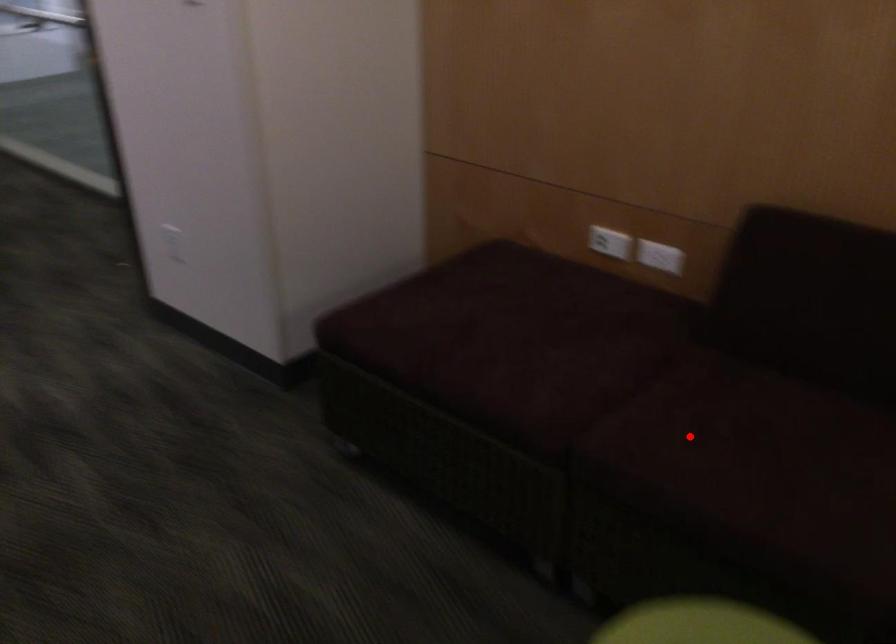
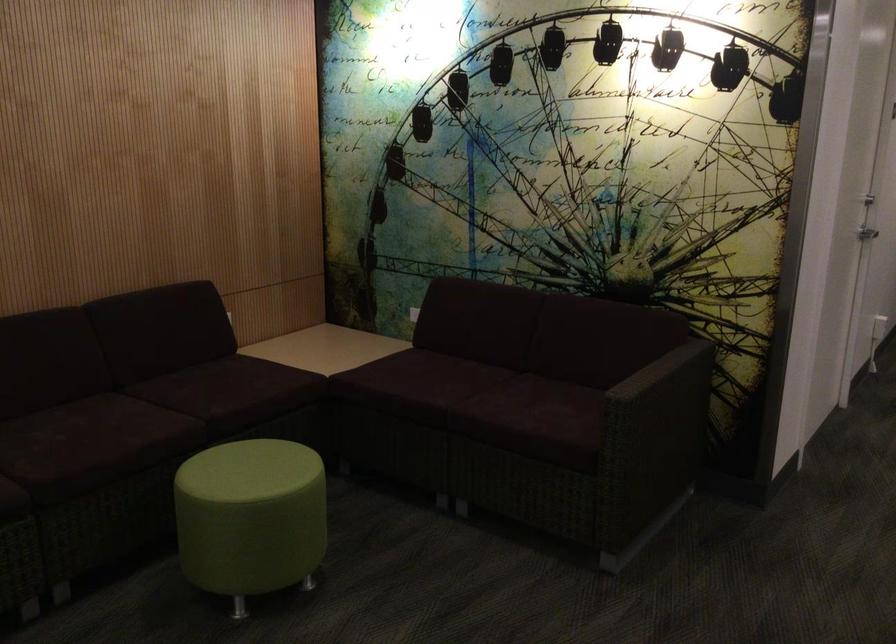
Locate, in the second image, the point that corresponds to the highlighted location in the first image.

(67, 440)